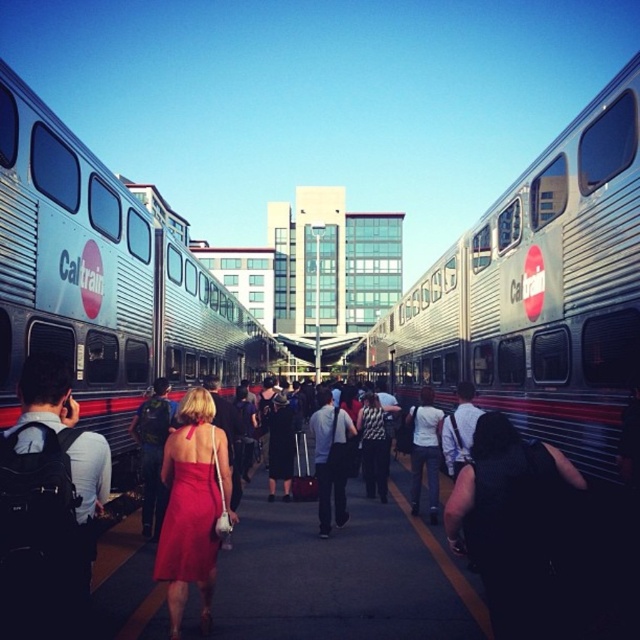
You are a passenger at the train station and want to board the nearest train. You are standing at the center of the platform. Which train, the silver metallic train at center or the silver metallic train at left, is closer to you?

The silver metallic train at center is closer to you since you are standing at the center of the platform.

You are standing on the train station platform and want to walk from point (600,163) to point (212,461). Which direction should you move to get closer to your destination?

You should move away from the viewer because point (600,163) is further to the viewer than point (212,461).